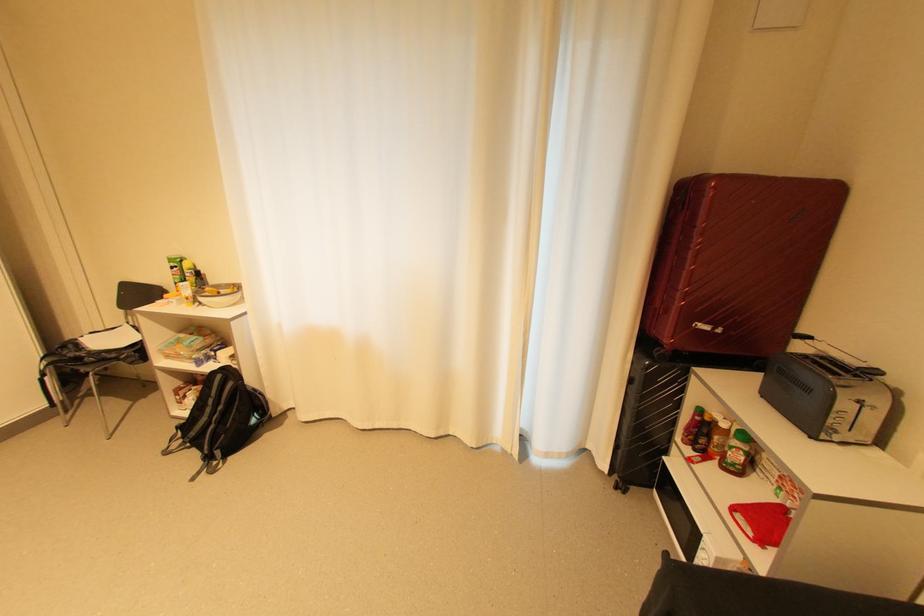
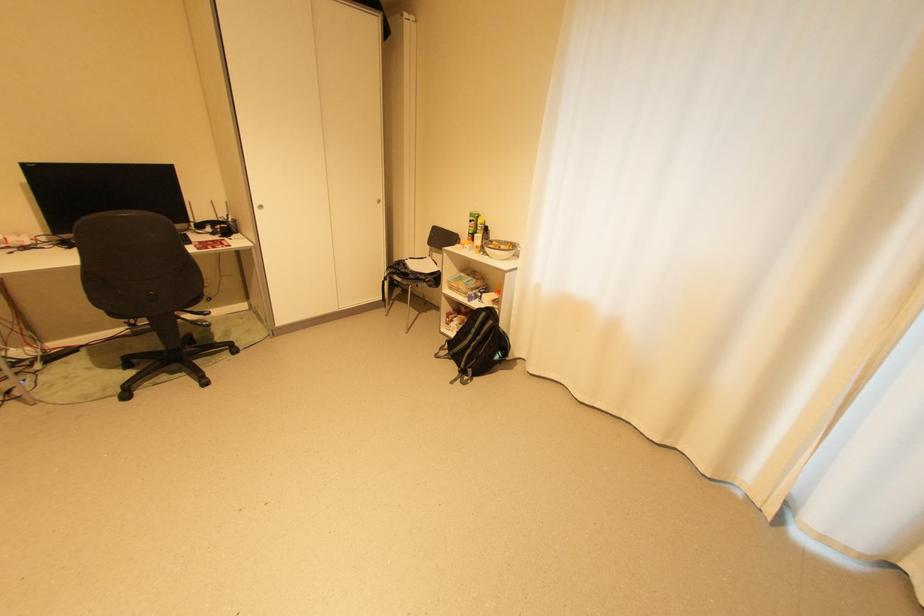
Where in the second image is the point corresponding to [184,270] from the first image?

(480, 223)